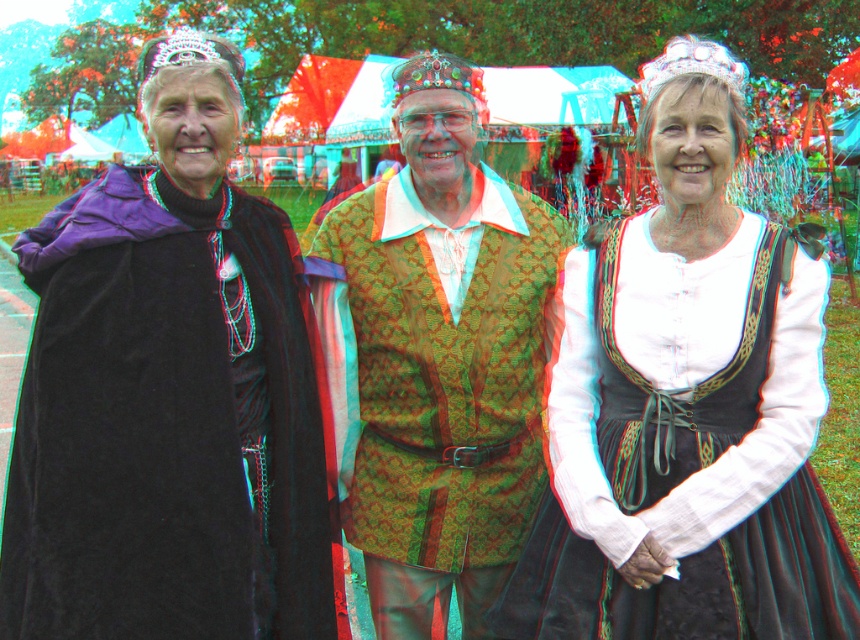
You are a photographer at the event and need to position the velvet black cape at left and the velvet black dress at center so that they both fit within a wide frame. Based on their widths, which one should be placed closer to the edge of the frame to ensure both fit?

The velvet black cape at left has a lesser width compared to the velvet black dress at center, so placing the wider velvet black dress at center near the center of the frame and the narrower velvet black cape at left towards the edge would ensure both fit within the frame.

You are a photographer at the event and need to position a spotlight exactly at point (686,408). What object will the spotlight illuminate?

The spotlight at point (686,408) will illuminate the velvet black dress at center.